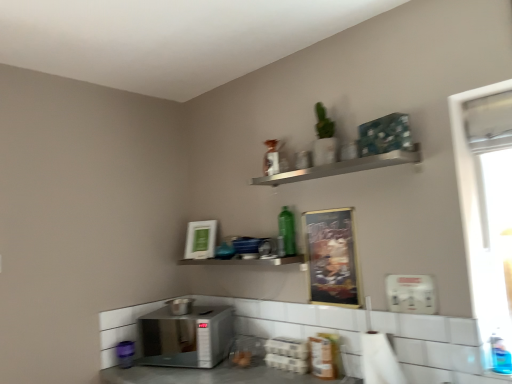
Question: Can you confirm if green glass bottle at center, which is the 2th bottle in front-to-back order, is wider than white plastic window screen at right?

Choices:
 (A) yes
 (B) no

Answer: (B)

Question: Considering the relative sizes of green glass bottle at center, which appears as the first bottle when viewed from the left, and white plastic window screen at right in the image provided, is green glass bottle at center, which appears as the first bottle when viewed from the left, smaller than white plastic window screen at right?

Choices:
 (A) yes
 (B) no

Answer: (A)

Question: Is green glass bottle at center, which is the 2th bottle in front-to-back order, not near white plastic window screen at right?

Choices:
 (A) yes
 (B) no

Answer: (B)

Question: From the image's perspective, is green glass bottle at center, acting as the 1th bottle starting from the top, below white plastic window screen at right?

Choices:
 (A) no
 (B) yes

Answer: (B)

Question: Considering the relative sizes of green glass bottle at center, acting as the 1th bottle starting from the top, and white plastic window screen at right in the image provided, is green glass bottle at center, acting as the 1th bottle starting from the top, shorter than white plastic window screen at right?

Choices:
 (A) no
 (B) yes

Answer: (B)

Question: Based on their positions, is green glass bottle at center, arranged as the 1th bottle when viewed from the back, located to the left or right of metallic gold bulletin board at center?

Choices:
 (A) right
 (B) left

Answer: (B)

Question: Is green glass bottle at center, arranged as the 2th bottle when ordered from the bottom, spatially inside metallic gold bulletin board at center, or outside of it?

Choices:
 (A) outside
 (B) inside

Answer: (A)

Question: In terms of size, does green glass bottle at center, which is the 2th bottle in front-to-back order, appear bigger or smaller than metallic gold bulletin board at center?

Choices:
 (A) small
 (B) big

Answer: (A)

Question: From a real-world perspective, is green glass bottle at center, arranged as the 2th bottle when ordered from the bottom, positioned above or below metallic gold bulletin board at center?

Choices:
 (A) above
 (B) below

Answer: (A)

Question: Considering the positions of point (198, 226) and point (392, 283), is point (198, 226) closer or farther from the camera than point (392, 283)?

Choices:
 (A) farther
 (B) closer

Answer: (A)

Question: Considering the relative positions of green matte picture frame at upper center and white plastic dispenser at lower right, which is the 1th appliance from top to bottom, in the image provided, is green matte picture frame at upper center to the left or to the right of white plastic dispenser at lower right, which is the 1th appliance from top to bottom,?

Choices:
 (A) right
 (B) left

Answer: (B)

Question: Is green matte picture frame at upper center inside the boundaries of white plastic dispenser at lower right, which is the 1th appliance from top to bottom, or outside?

Choices:
 (A) inside
 (B) outside

Answer: (B)

Question: From a real-world perspective, relative to white plastic dispenser at lower right, which appears as the third appliance when ordered from the bottom, is green matte picture frame at upper center vertically above or below?

Choices:
 (A) above
 (B) below

Answer: (A)

Question: Does point (331, 241) appear closer or farther from the camera than point (233, 258)?

Choices:
 (A) closer
 (B) farther

Answer: (A)

Question: From their relative heights in the image, would you say metallic gold bulletin board at center is taller or shorter than metallic silver shelf at center, the 2th shelf when ordered from top to bottom?

Choices:
 (A) tall
 (B) short

Answer: (A)